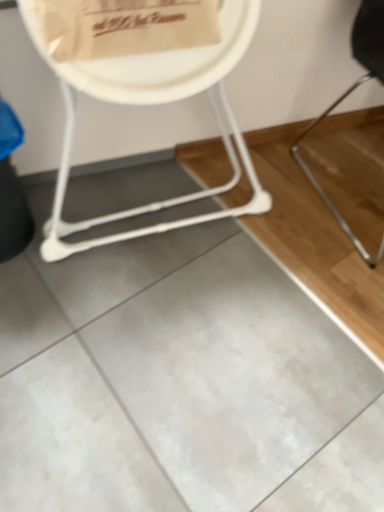
The height and width of the screenshot is (512, 384). In order to click on vacant space that is in between black metal chair at right, the 2th chair positioned from the left, and white plastic chair at upper left, the 2th chair in the right-to-left sequence in this screenshot , I will do `click(264, 220)`.